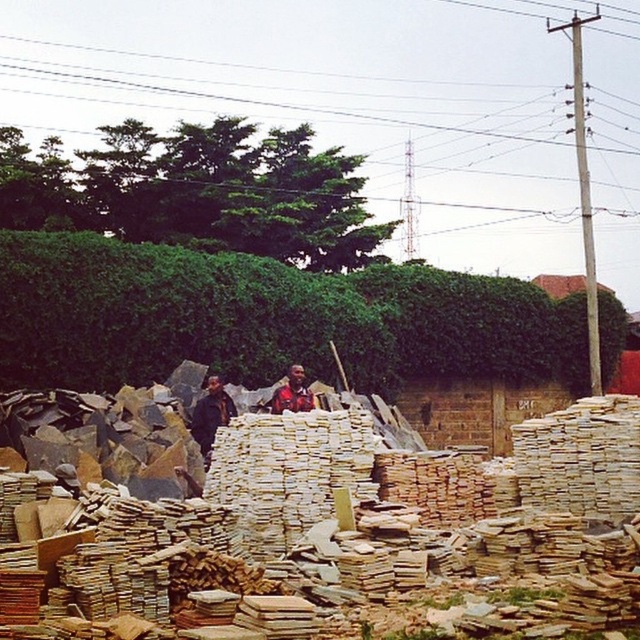
You are a construction worker standing at the edge of the site. You need to hand a tool to the person wearing the dark brown leather jacket at center without moving from your position. Is the green leafy hedge at center blocking your direct line of sight to the jacket?

The green leafy hedge at center is located above the dark brown leather jacket at center, so it is blocking the direct line of sight to the jacket.

You are a delivery person who needs to deliver a package to the construction site. You see the green leafy hedge at center and the dark brown leather jacket at center. Which object is bigger?

The green leafy hedge at center is larger in size than the dark brown leather jacket at center, so the green leafy hedge at center is bigger.